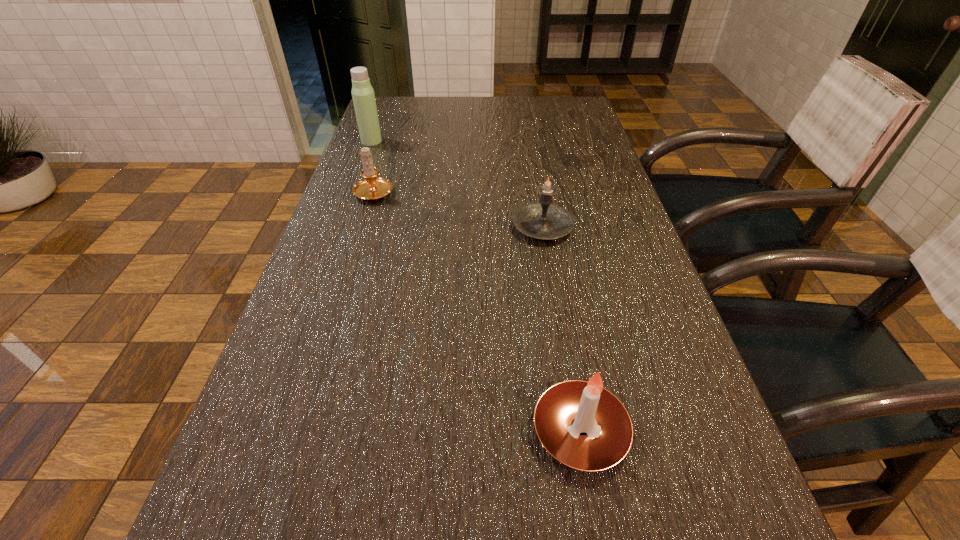
Where is `thermos bottle that is at the left edge`? This screenshot has height=540, width=960. thermos bottle that is at the left edge is located at coordinates (363, 96).

This screenshot has height=540, width=960. In order to click on candle located at the left edge in this screenshot , I will do `click(371, 188)`.

This screenshot has width=960, height=540. What are the coordinates of `vacant space at the far edge` in the screenshot? It's located at (482, 104).

Where is `free region at the left edge of the desktop`? This screenshot has height=540, width=960. free region at the left edge of the desktop is located at coordinates (383, 161).

At what (x,y) coordinates should I click in order to perform the action: click on vacant region at the right edge of the desktop. Please return your answer as a coordinate pair (x, y). This screenshot has height=540, width=960. Looking at the image, I should click on (564, 140).

Locate an element on the screen. free space at the far left corner of the desktop is located at coordinates (417, 107).

What are the coordinates of `blank space at the far right corner of the desktop` in the screenshot? It's located at 547,114.

Locate an element on the screen. This screenshot has height=540, width=960. free point between the tallest object and the second nearest object is located at coordinates (457, 184).

The height and width of the screenshot is (540, 960). Find the location of `free space between the nearest candle and the third nearest object`. free space between the nearest candle and the third nearest object is located at coordinates (477, 311).

I want to click on vacant space that is in between the third farthest object and the nearest candle, so click(x=562, y=329).